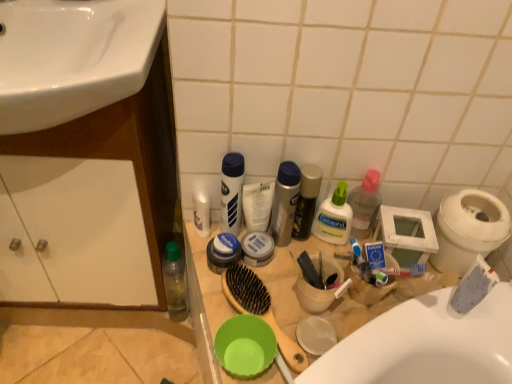
Question: Does white glossy sink at upper left turn towards matte white cream container at center, which is the 5th toiletry in right-to-left order?

Choices:
 (A) yes
 (B) no

Answer: (B)

Question: Is white glossy sink at upper left positioned beyond the bounds of matte white cream container at center, acting as the fourth toiletry starting from the left?

Choices:
 (A) yes
 (B) no

Answer: (A)

Question: Can you confirm if white glossy sink at upper left is positioned to the right of matte white cream container at center, which is the 5th toiletry in right-to-left order?

Choices:
 (A) no
 (B) yes

Answer: (A)

Question: Is the surface of white glossy sink at upper left in direct contact with matte white cream container at center, acting as the fourth toiletry starting from the left?

Choices:
 (A) no
 (B) yes

Answer: (A)

Question: From the image's perspective, is white glossy sink at upper left located beneath matte white cream container at center, acting as the fourth toiletry starting from the left?

Choices:
 (A) yes
 (B) no

Answer: (B)

Question: Is white matte toothpaste at right, marked as the 1th toothpaste in a right-to-left arrangement, wider or thinner than matte white cream container at center, which is the 5th toiletry in right-to-left order?

Choices:
 (A) thin
 (B) wide

Answer: (A)

Question: Is white matte toothpaste at right, placed as the first toothpaste when sorted from front to back, taller or shorter than matte white cream container at center, which is the 5th toiletry in right-to-left order?

Choices:
 (A) tall
 (B) short

Answer: (A)

Question: From a real-world perspective, relative to matte white cream container at center, which is the 5th toiletry in right-to-left order, is white matte toothpaste at right, marked as the 1th toothpaste in a right-to-left arrangement, vertically above or below?

Choices:
 (A) above
 (B) below

Answer: (A)

Question: From the image's perspective, is white matte toothpaste at right, placed as the first toothpaste when sorted from front to back, above or below matte white cream container at center, which is the 5th toiletry in right-to-left order?

Choices:
 (A) above
 (B) below

Answer: (B)

Question: In terms of size, does silver metallic can at center, the fourth toiletry in the right-to-left sequence, appear bigger or smaller than green plastic bottle at lower left?

Choices:
 (A) big
 (B) small

Answer: (B)

Question: Is silver metallic can at center, the fourth toiletry in the right-to-left sequence, in front of or behind green plastic bottle at lower left in the image?

Choices:
 (A) front
 (B) behind

Answer: (A)

Question: From the image's perspective, relative to green plastic bottle at lower left, is silver metallic can at center, positioned as the fifth toiletry in left-to-right order, above or below?

Choices:
 (A) below
 (B) above

Answer: (B)

Question: Visually, is silver metallic can at center, positioned as the fifth toiletry in left-to-right order, positioned to the left or to the right of green plastic bottle at lower left?

Choices:
 (A) right
 (B) left

Answer: (A)

Question: Which is correct: wooden counter top at center is inside white plastic bidet at right, or outside of it?

Choices:
 (A) inside
 (B) outside

Answer: (B)

Question: From the image's perspective, is wooden counter top at center above or below white plastic bidet at right?

Choices:
 (A) above
 (B) below

Answer: (B)